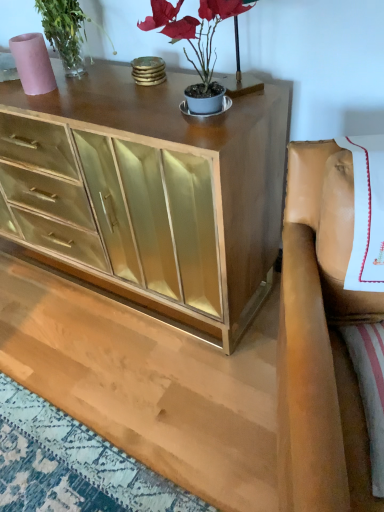
Question: Would you say leather at right is outside matte gold plant at upper center?

Choices:
 (A) yes
 (B) no

Answer: (A)

Question: Is leather at right next to matte gold plant at upper center and touching it?

Choices:
 (A) yes
 (B) no

Answer: (B)

Question: Is leather at right positioned before matte gold plant at upper center?

Choices:
 (A) yes
 (B) no

Answer: (A)

Question: Are leather at right and matte gold plant at upper center far apart?

Choices:
 (A) yes
 (B) no

Answer: (B)

Question: Is leather at right thinner than matte gold plant at upper center?

Choices:
 (A) yes
 (B) no

Answer: (B)

Question: Can you confirm if leather at right is bigger than matte gold plant at upper center?

Choices:
 (A) yes
 (B) no

Answer: (A)

Question: From the image's perspective, is matte pink vase at upper left over leather at right?

Choices:
 (A) yes
 (B) no

Answer: (A)

Question: Does matte pink vase at upper left have a lesser width compared to leather at right?

Choices:
 (A) yes
 (B) no

Answer: (A)

Question: Considering the relative positions of matte pink vase at upper left and leather at right in the image provided, is matte pink vase at upper left to the right of leather at right from the viewer's perspective?

Choices:
 (A) yes
 (B) no

Answer: (B)

Question: Can you confirm if matte pink vase at upper left is positioned to the left of leather at right?

Choices:
 (A) yes
 (B) no

Answer: (A)

Question: Can you confirm if matte pink vase at upper left is bigger than leather at right?

Choices:
 (A) no
 (B) yes

Answer: (A)

Question: Is matte pink vase at upper left not within leather at right?

Choices:
 (A) yes
 (B) no

Answer: (A)

Question: Considering the relative sizes of matte pink vase at upper left and matte gold plant at upper center in the image provided, is matte pink vase at upper left shorter than matte gold plant at upper center?

Choices:
 (A) no
 (B) yes

Answer: (B)